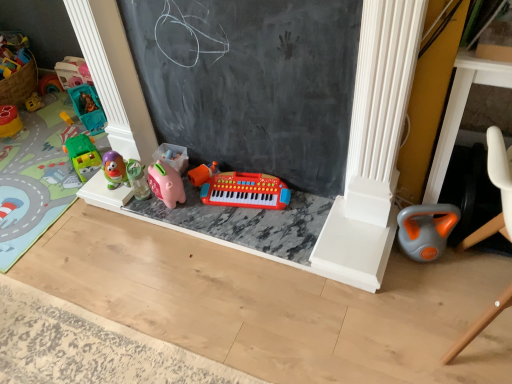
What are the coordinates of `free area behind rubberized green car at left, which ranks as the first toy in left-to-right order` in the screenshot? It's located at (35, 109).